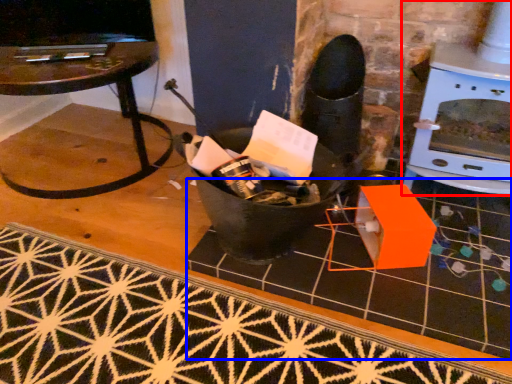
Question: Which of the following is the farthest to the observer, fireplace (highlighted by a red box) or tile (highlighted by a blue box)?

Choices:
 (A) fireplace
 (B) tile

Answer: (A)